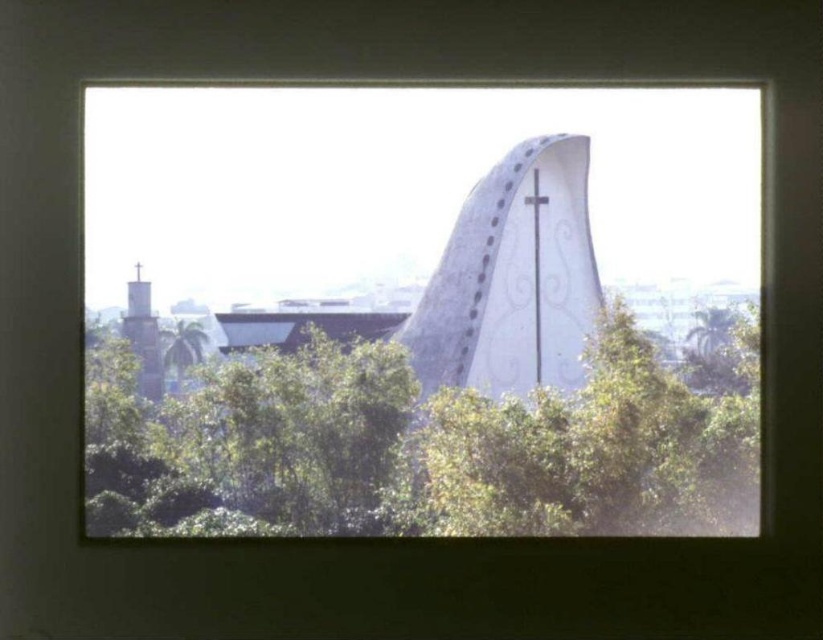
You are a painter standing 10 feet away from the window. You want to paint the smooth gray stone spire at left and the green leafy tree at lower left. If your canvas can only capture objects within a 15 inch span, will both objects fit on the canvas?

The distance between the smooth gray stone spire at left and the green leafy tree at lower left is 17.79 inches. Since your canvas can only capture objects within a 15 inch span, the two objects are too far apart to fit on the canvas.

You are standing in front of the window shown in the image. There is a point marked at coordinates (429, 442). Based on the scene description, can you determine what object this point is located on?

The point at coordinates (429, 442) is located on the green leafy tree at center.

You are standing outside looking through the window and see the green leafy tree at center. Based on its position relative to the architectural structure with the dome, can you determine if the tree is closer to you or farther away?

The green leafy tree at center is located at point (x=429, y=442), which places it closer to the viewer than the dome structure in the background. Therefore, the tree is closer to you.